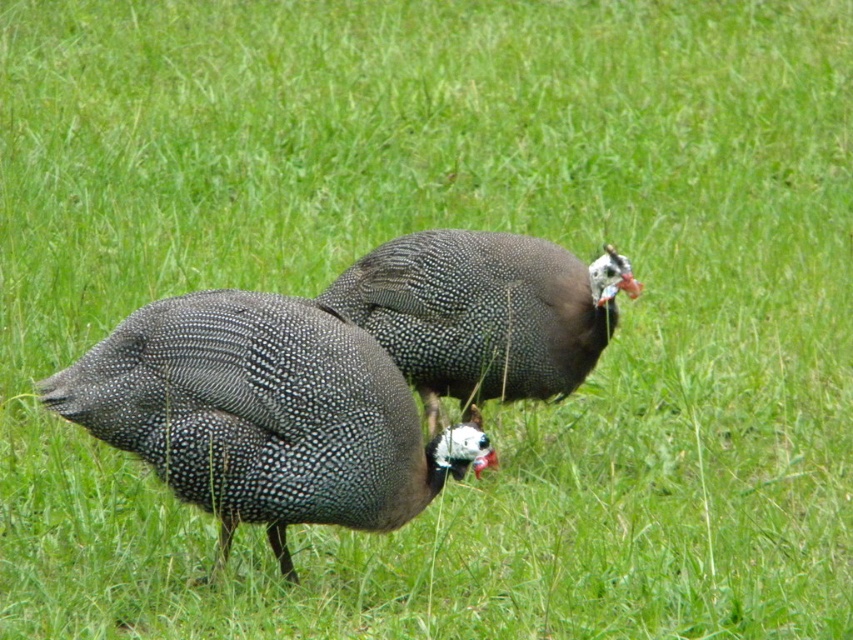
You are a farmer who wants to build a fence around the field where both the speckled feathered turkey at center and the speckled feathered guinea fowl at center are. Since the turkey is taller, you need to ensure the fence height allows both animals to move freely without touching their heads. If the guinea fowl requires a minimum of 1 meter of headroom, what is the minimum height the fence should be?

The speckled feathered turkey at center is much taller than the speckled feathered guinea fowl at center. Since the guinea fowl requires 1 meter of headroom, the fence must be at least 1 meter plus the additional height difference between the turkey and the guinea fowl to accommodate the turkey comfortably. Therefore, the minimum fence height should be greater than 1 meter, specifically the height of the turkey plus 1 meter.

You are a farmer trying to identify which bird is closer to the ground. You see a speckled feathered turkey at center and a speckled feathered guinea fowl at center. Which one is lower in position?

The speckled feathered turkey at center is below the speckled feathered guinea fowl at center, so the turkey is lower.

You are a farmer checking on your birds in the field. You notice a speckled feathered turkey at center and a speckled feathered guinea fowl at center. Which bird is closer to you?

The speckled feathered guinea fowl at center is closer to you since it is only 1.05 meters away from the speckled feathered turkey at center, but the question is which is closer to you. Wait, the description says the turkey is 1.05 meters away from the guinea fowl. Since both are at center, maybe they are side by side? Hmm, need to clarify. The answer should be that the distance between them is 1.05 meters, but the question asks which is closer to the observer. Since both are at the center, perhaps they are